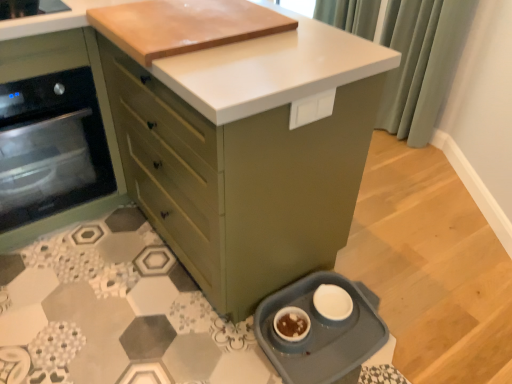
Question: Considering the relative positions of blue plastic pet dish at lower right and white matte bowl at lower center in the image provided, is blue plastic pet dish at lower right to the left or to the right of white matte bowl at lower center?

Choices:
 (A) right
 (B) left

Answer: (A)

Question: Considering the positions of point (322, 372) and point (309, 326), is point (322, 372) closer or farther from the camera than point (309, 326)?

Choices:
 (A) farther
 (B) closer

Answer: (B)

Question: Considering the real-world distances, which object is closest to the white matte bowl at lower center?

Choices:
 (A) blue plastic pet dish at lower right
 (B) matte green oven at left, the second cabinetry viewed from the right
 (C) matte green cabinet at center, the first cabinetry viewed from the right
 (D) green fabric curtain at upper right

Answer: (A)

Question: Which object is positioned closest to the matte green cabinet at center, arranged as the second cabinetry when viewed from the left?

Choices:
 (A) blue plastic pet dish at lower right
 (B) green fabric curtain at upper right
 (C) white matte bowl at lower center
 (D) matte green oven at left, the 1th cabinetry in the left-to-right sequence

Answer: (A)